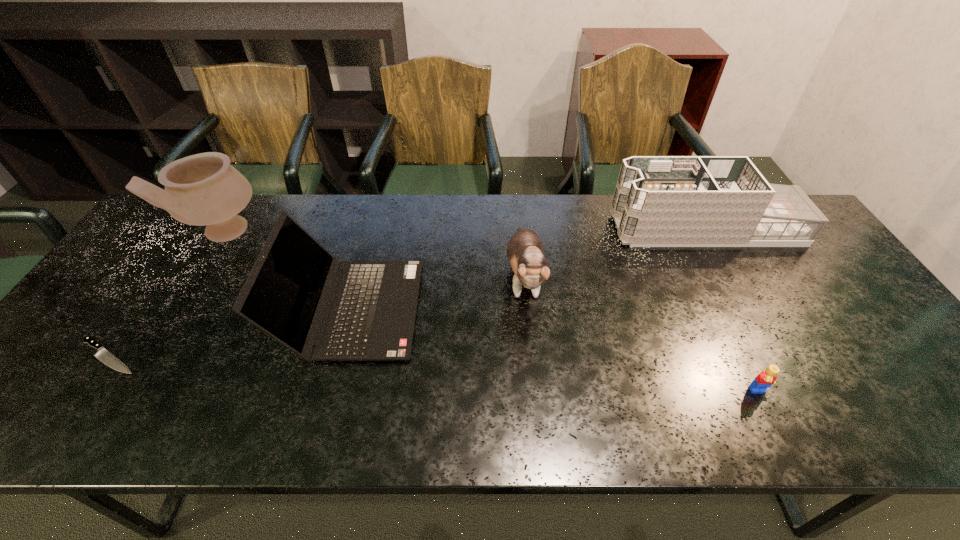
I want to click on steak knife located at the left edge, so click(x=102, y=354).

Identify the location of object positioned at the right edge. (659, 201).

Locate an element on the screen. The image size is (960, 540). object at the far left corner is located at coordinates (203, 189).

In order to click on object that is at the far right corner in this screenshot , I will do `click(659, 201)`.

Where is `vacant point at the far edge`? vacant point at the far edge is located at coordinates (549, 219).

Where is `vacant area at the near edge`? vacant area at the near edge is located at coordinates (871, 423).

The height and width of the screenshot is (540, 960). In the image, there is a desktop. Identify the location of vacant space at the left edge. (81, 376).

Where is `blank area at the right edge`? blank area at the right edge is located at coordinates (831, 278).

I want to click on vacant space at the near left corner, so click(x=74, y=404).

Where is `free spot between the third object from right to left and the laptop computer`? The height and width of the screenshot is (540, 960). free spot between the third object from right to left and the laptop computer is located at coordinates (438, 294).